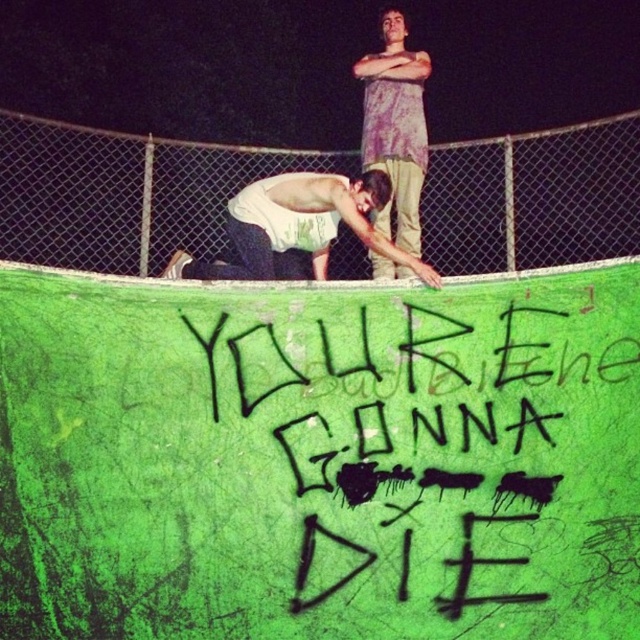
Between white cotton shirt at center and distressed purple shirt at upper center, which one appears on the right side from the viewer's perspective?

distressed purple shirt at upper center is more to the right.

Is white cotton shirt at center shorter than distressed purple shirt at upper center?

Yes.

This screenshot has width=640, height=640. What do you see at coordinates (298, 228) in the screenshot? I see `white cotton shirt at center` at bounding box center [298, 228].

What are the coordinates of `white cotton shirt at center` in the screenshot? It's located at (298, 228).

Who is positioned more to the left, black spray paint graffiti at center or distressed purple shirt at upper center?

distressed purple shirt at upper center is more to the left.

Is point (544, 348) closer to viewer compared to point (371, 90)?

That is True.

This screenshot has height=640, width=640. Identify the location of black spray paint graffiti at center. (416, 461).

Is black spray paint graffiti at center closer to the viewer compared to green chain-link fence at upper center?

Yes, it is in front of green chain-link fence at upper center.

Locate an element on the screen. The width and height of the screenshot is (640, 640). black spray paint graffiti at center is located at coordinates (416, 461).

This screenshot has height=640, width=640. Identify the location of black spray paint graffiti at center. (416, 461).